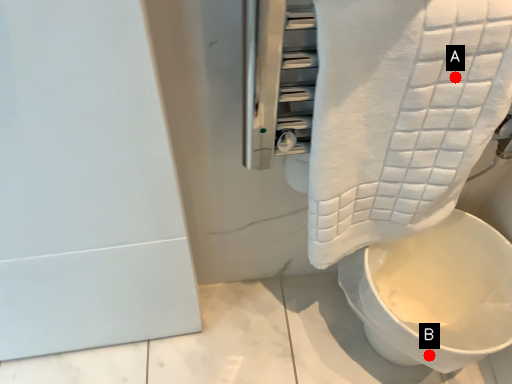
Question: Two points are circled on the image, labeled by A and B beside each circle. Which point is farther from the camera taking this photo?

Choices:
 (A) A is further
 (B) B is further

Answer: (B)